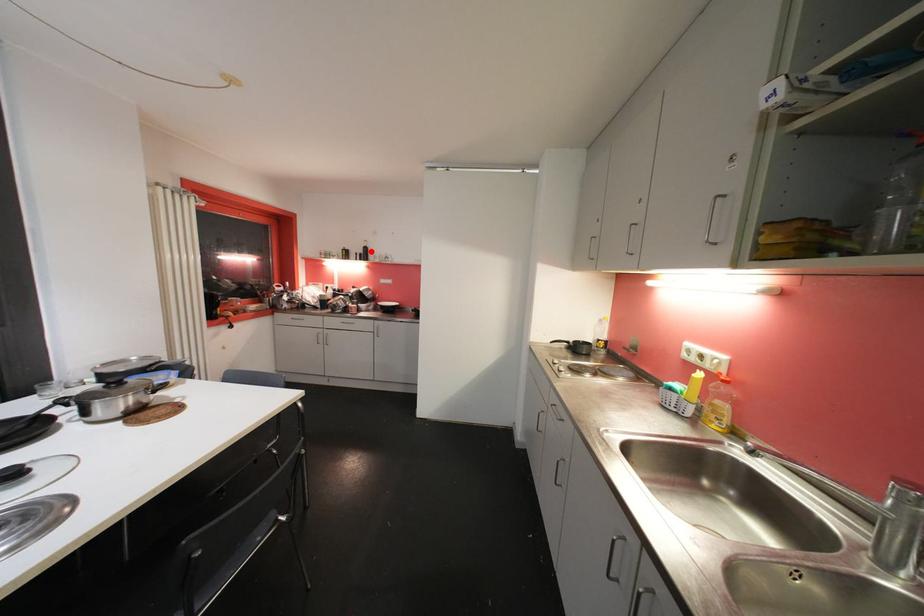
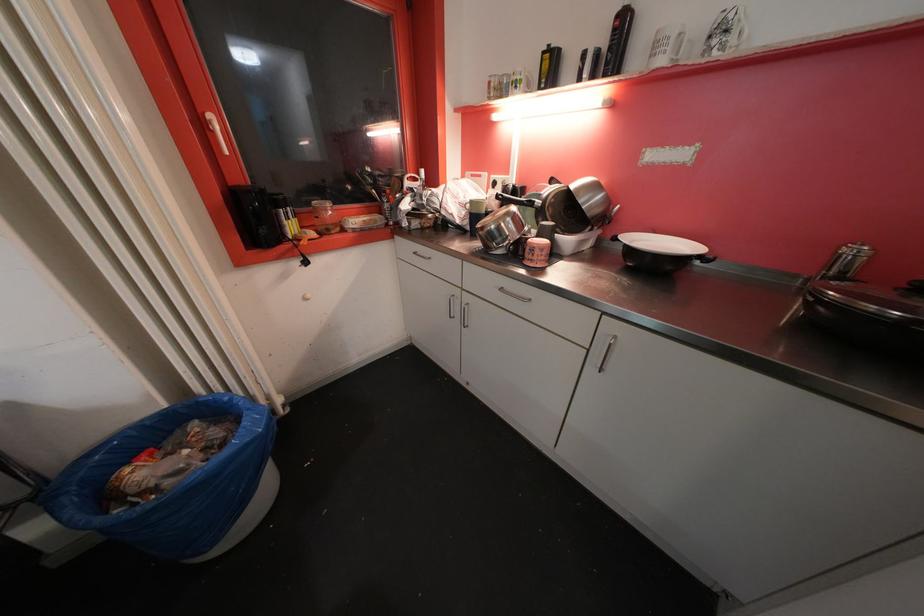
In the second image, find the point that corresponds to the highlighted location in the first image.

(628, 25)